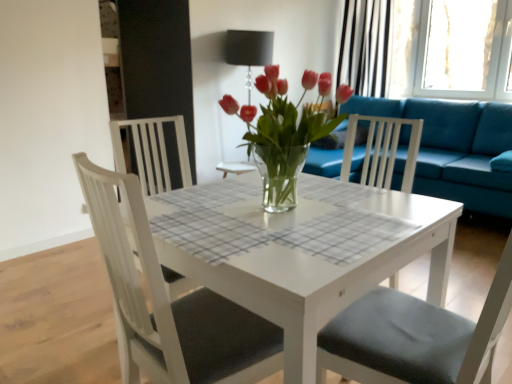
Question: From the image's perspective, is transparent glass window at upper right positioned above or below matte black lampshade at center?

Choices:
 (A) below
 (B) above

Answer: (B)

Question: In terms of height, does transparent glass window at upper right look taller or shorter compared to matte black lampshade at center?

Choices:
 (A) short
 (B) tall

Answer: (A)

Question: Which object is the farthest from the transparent glass window at upper right?

Choices:
 (A) white matte chair at center, the 2th chair when ordered from right to left
 (B) white matte chair at center, the second chair from the left
 (C) black striped curtain at upper right
 (D) matte black lampshade at center
 (E) teal fabric couch at right

Answer: (A)

Question: Considering the real-world distances, which object is farthest from the transparent glass window at upper right?

Choices:
 (A) teal fabric couch at right
 (B) white glossy table at center
 (C) white matte chair at center, the second chair from the left
 (D) white matte chair at center, the 2th chair when ordered from right to left
 (E) clear glass vase at center

Answer: (D)